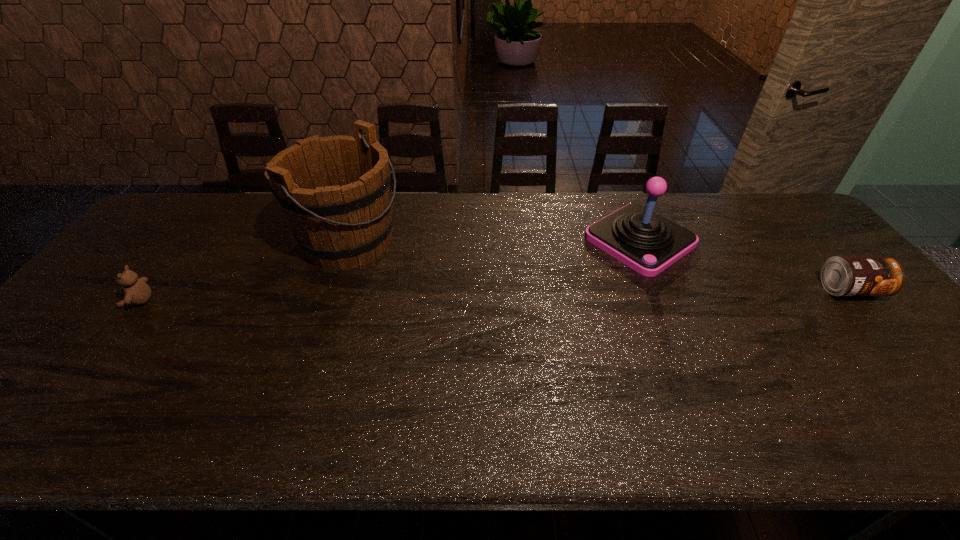
Locate an element on the screen. vacant space located 0.140m forward from the base of the joystick is located at coordinates (571, 283).

Locate an element on the screen. The width and height of the screenshot is (960, 540). free space located on the side of the second object from left to right with the handle for carrying is located at coordinates (443, 284).

The width and height of the screenshot is (960, 540). I want to click on free point located on the side of the second object from left to right with the handle for carrying, so click(x=483, y=301).

Where is `vacant space located 0.080m on the side of the second object from left to right with the handle for carrying`? The image size is (960, 540). vacant space located 0.080m on the side of the second object from left to right with the handle for carrying is located at coordinates (411, 269).

Locate an element on the screen. joystick at the far edge is located at coordinates [x=648, y=243].

You are a GUI agent. You are given a task and a screenshot of the screen. Output one action in this format:
    pyautogui.click(x=<x>, y=<y>)
    Task: Click on the wine bucket that is at the far edge
    Image resolution: width=960 pixels, height=540 pixels.
    Given the screenshot: What is the action you would take?
    pyautogui.click(x=334, y=191)

You are a GUI agent. You are given a task and a screenshot of the screen. Output one action in this format:
    pyautogui.click(x=<x>, y=<y>)
    Task: Click on the object that is at the left edge
    
    Given the screenshot: What is the action you would take?
    pyautogui.click(x=137, y=292)

Image resolution: width=960 pixels, height=540 pixels. What are the coordinates of `object that is at the right edge` in the screenshot? It's located at (840, 275).

Image resolution: width=960 pixels, height=540 pixels. In order to click on vacant region at the far edge of the desktop in this screenshot , I will do 556,223.

The image size is (960, 540). In order to click on vacant area at the near edge of the desktop in this screenshot , I will do `click(126, 366)`.